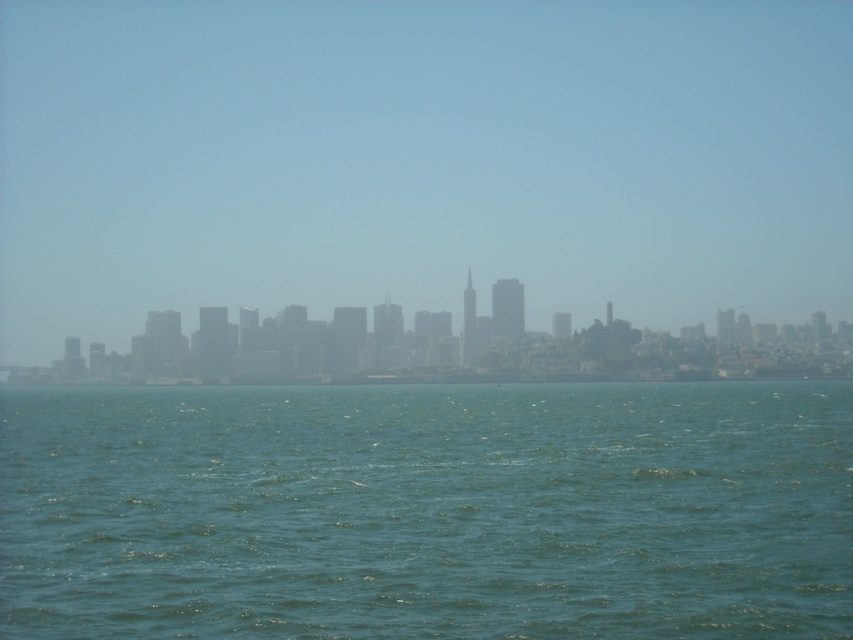
Question: Can you confirm if transparent foggy skyline at center is positioned below green water at lower center?

Choices:
 (A) no
 (B) yes

Answer: (A)

Question: Which of the following is the farthest from the observer?

Choices:
 (A) gray foggy skyline at center
 (B) green water at lower center
 (C) transparent foggy skyline at center

Answer: (C)

Question: Is green water at lower center below gray foggy skyline at center?

Choices:
 (A) no
 (B) yes

Answer: (B)

Question: Which of the following is the farthest from the observer?

Choices:
 (A) green water at lower center
 (B) gray foggy skyline at center

Answer: (B)

Question: Does green water at lower center appear on the right side of gray foggy skyline at center?

Choices:
 (A) yes
 (B) no

Answer: (A)

Question: Which object appears farthest from the camera in this image?

Choices:
 (A) transparent foggy skyline at center
 (B) green water at lower center
 (C) gray foggy skyline at center

Answer: (A)